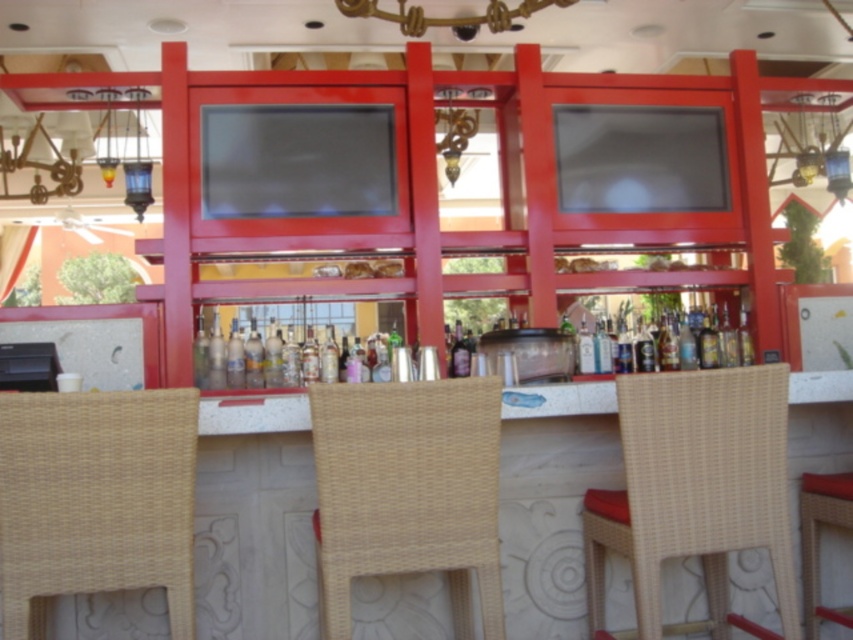
You are standing at the entrance of the bar and want to sit down. The entrance is at point 0.0. The woven rattan chair at center is located at point 0.762. Is the chair to your left or right?

The woven rattan chair at center is located at point 0.762, which is to the right of the entrance at point 0.0.

You are a customer at the bar and want to sit down. There is a woven rattan bar stool at lower right and a translucent glass bottle at center. Which object is closer to you as you approach the bar?

The woven rattan bar stool at lower right is closer to you because it is in front of the translucent glass bottle at center.

You are a bartender preparing a drink and need to move the translucent glass bottle at center to the left. Which direction should you move it so it is no longer to the right of the woven rattan bar stool at lower right?

To move the translucent glass bottle at center so it is no longer to the right of the woven rattan bar stool at lower right, you should move it to the left. This will position the bottle to the left of the stool.